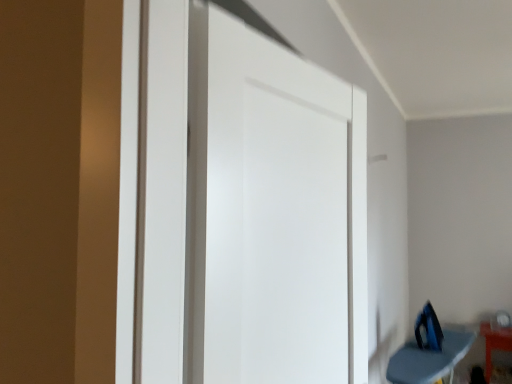
Question: Is white matte door at center taller than orange glossy table at lower right, which is the 1th furniture from back to front?

Choices:
 (A) no
 (B) yes

Answer: (B)

Question: Does white matte door at center have a greater width compared to orange glossy table at lower right, positioned as the 2th furniture in left-to-right order?

Choices:
 (A) yes
 (B) no

Answer: (B)

Question: Can you confirm if white matte door at center is thinner than orange glossy table at lower right, the first furniture positioned from the right?

Choices:
 (A) no
 (B) yes

Answer: (B)

Question: Is white matte door at center at the left side of orange glossy table at lower right, which is the 1th furniture from back to front?

Choices:
 (A) yes
 (B) no

Answer: (A)

Question: Is white matte door at center oriented towards orange glossy table at lower right, positioned as the 2th furniture in left-to-right order?

Choices:
 (A) no
 (B) yes

Answer: (A)

Question: Would you say white matte door at center is outside orange glossy table at lower right, the first furniture positioned from the right?

Choices:
 (A) no
 (B) yes

Answer: (B)

Question: Is white matte door at center at the back of orange glossy table at lower right, positioned as the 2th furniture in left-to-right order?

Choices:
 (A) no
 (B) yes

Answer: (A)

Question: From a real-world perspective, is orange glossy table at lower right, which is the 1th furniture from back to front, beneath white matte door at center?

Choices:
 (A) no
 (B) yes

Answer: (B)

Question: From the image's perspective, would you say orange glossy table at lower right, positioned as the 2th furniture in front-to-back order, is positioned over white matte door at center?

Choices:
 (A) no
 (B) yes

Answer: (A)

Question: Can you see orange glossy table at lower right, which is the 1th furniture from back to front, touching white matte door at center?

Choices:
 (A) no
 (B) yes

Answer: (A)

Question: Could you tell me if orange glossy table at lower right, which is the 1th furniture from back to front, is turned towards white matte door at center?

Choices:
 (A) yes
 (B) no

Answer: (A)

Question: Can you confirm if orange glossy table at lower right, positioned as the 2th furniture in front-to-back order, is bigger than white matte door at center?

Choices:
 (A) yes
 (B) no

Answer: (B)

Question: Is orange glossy table at lower right, the first furniture positioned from the right, inside blue fabric ironing board at lower right, which ranks as the second furniture in back-to-front order?

Choices:
 (A) yes
 (B) no

Answer: (B)